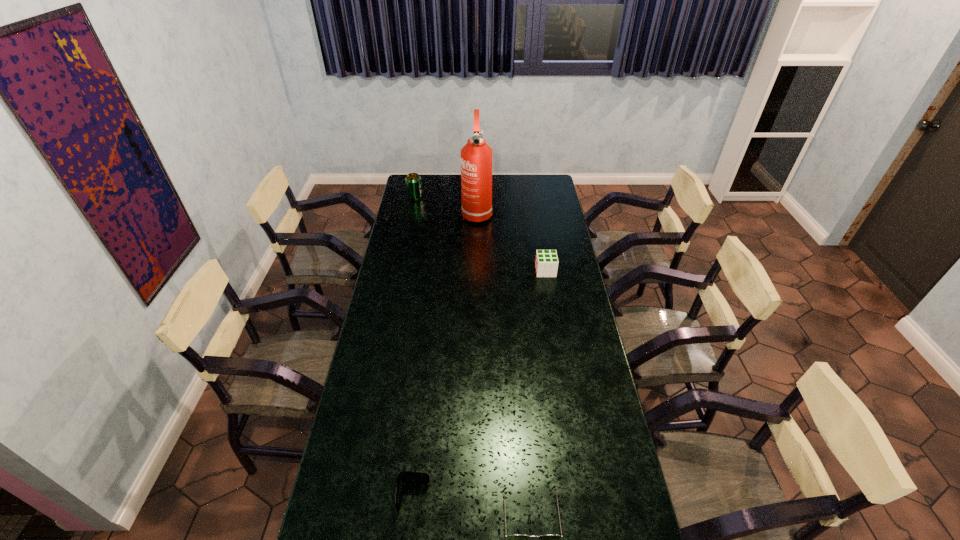
Where is `vacant space at the right edge of the desktop`? The image size is (960, 540). vacant space at the right edge of the desktop is located at coordinates (584, 404).

Identify the location of free region at the far right corner of the desktop. Image resolution: width=960 pixels, height=540 pixels. (543, 189).

The height and width of the screenshot is (540, 960). I want to click on blank region between the leftmost object and the third object from right to left, so click(445, 205).

I want to click on free space between the second shortest object and the fourth shortest object, so click(415, 347).

The width and height of the screenshot is (960, 540). I want to click on vacant area that lies between the fourth object from right to left and the beer can, so click(x=415, y=347).

This screenshot has width=960, height=540. What are the coordinates of `vacant area that lies between the fourth object from right to left and the fourth shortest object` in the screenshot? It's located at (415, 347).

Identify the location of empty space between the tallest object and the leftmost object. The image size is (960, 540). pyautogui.click(x=445, y=205).

The width and height of the screenshot is (960, 540). What are the coordinates of `unoccupied area between the second tallest object and the rightmost object` in the screenshot? It's located at (480, 234).

Where is `vacant space that's between the fire extinguisher and the fourth tallest object`? This screenshot has width=960, height=540. vacant space that's between the fire extinguisher and the fourth tallest object is located at coordinates (445, 355).

You are a GUI agent. You are given a task and a screenshot of the screen. Output one action in this format:
    pyautogui.click(x=<x>, y=<y>)
    Task: Click on the free space between the third tallest object and the second object from left to right
    
    Given the screenshot: What is the action you would take?
    pyautogui.click(x=480, y=384)